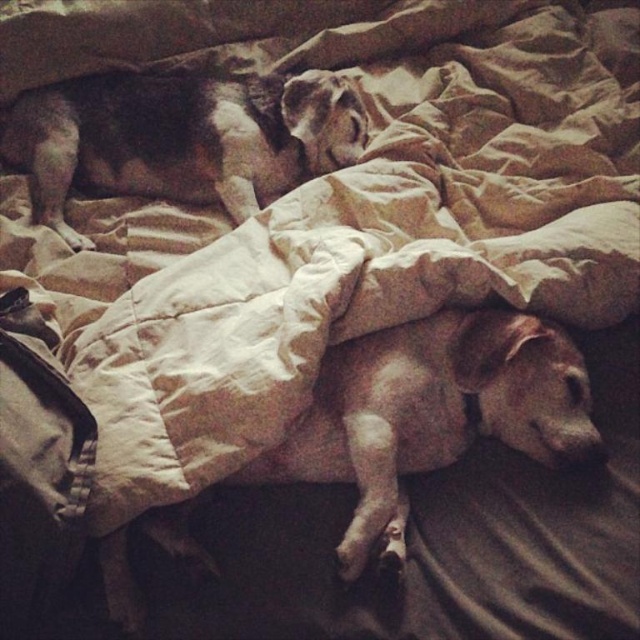
You are standing 1.5 meters away from the point at coordinates point (468, 416). Can you reach the point without moving closer?

The distance of point (468, 416) from viewer is 1.24 meters, so yes, you can reach the point without moving closer since you are already 1.5 meters away, which is farther than the point.

You are standing in a room and see a white smooth dog at lower right. If you want to pet the dog without moving closer than 3 feet, can you reach it?

The white smooth dog at lower right is 3.50 feet from the viewer, so you can reach it without moving closer than 3 feet since it is slightly farther away.

You are standing at the bed and want to gently wake up the white smooth dog at lower right without disturbing the other dog. Based on its position, where should you approach from?

The white smooth dog at lower right is located at point (429,413), so you should approach from the opposite side to avoid disturbing the other dog.